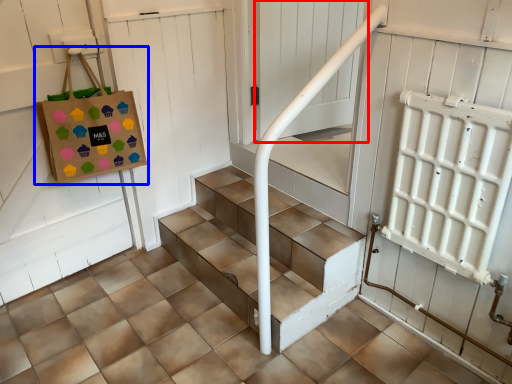
Question: Which of the following is the farthest to the observer, screen door (highlighted by a red box) or bag (highlighted by a blue box)?

Choices:
 (A) screen door
 (B) bag

Answer: (A)